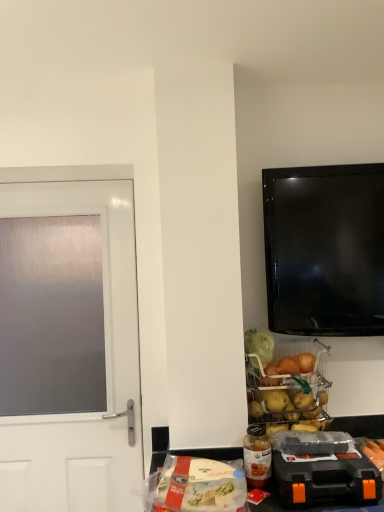
Question: From a real-world perspective, is orange plastic toolbox at lower right, which appears as the first appliance when viewed from the front, on top of translucent plastic bottle at lower center?

Choices:
 (A) no
 (B) yes

Answer: (A)

Question: Considering the relative positions of orange plastic toolbox at lower right, placed as the first appliance when sorted from bottom to top, and translucent plastic bottle at lower center in the image provided, is orange plastic toolbox at lower right, placed as the first appliance when sorted from bottom to top, to the right of translucent plastic bottle at lower center from the viewer's perspective?

Choices:
 (A) yes
 (B) no

Answer: (A)

Question: Is orange plastic toolbox at lower right, placed as the first appliance when sorted from bottom to top, turned away from translucent plastic bottle at lower center?

Choices:
 (A) no
 (B) yes

Answer: (A)

Question: Does orange plastic toolbox at lower right, which appears as the first appliance when viewed from the front, contain translucent plastic bottle at lower center?

Choices:
 (A) yes
 (B) no

Answer: (B)

Question: Is orange plastic toolbox at lower right, placed as the first appliance when sorted from bottom to top, directly adjacent to translucent plastic bottle at lower center?

Choices:
 (A) yes
 (B) no

Answer: (B)

Question: Is the position of orange plastic toolbox at lower right, the second appliance when ordered from top to bottom, more distant than that of translucent plastic bottle at lower center?

Choices:
 (A) yes
 (B) no

Answer: (B)

Question: Is translucent plastic bottle at lower center in front of metallic wire basket at lower center, the 2th appliance when ordered from front to back?

Choices:
 (A) no
 (B) yes

Answer: (B)

Question: Does translucent plastic bottle at lower center have a greater width compared to metallic wire basket at lower center, the 1th appliance from the top?

Choices:
 (A) no
 (B) yes

Answer: (A)

Question: Does translucent plastic bottle at lower center have a lesser width compared to metallic wire basket at lower center, which appears as the second appliance when ordered from the bottom?

Choices:
 (A) no
 (B) yes

Answer: (B)

Question: Are translucent plastic bottle at lower center and metallic wire basket at lower center, the 2th appliance when ordered from front to back, far apart?

Choices:
 (A) yes
 (B) no

Answer: (B)

Question: Is translucent plastic bottle at lower center oriented towards metallic wire basket at lower center, the 2th appliance when ordered from front to back?

Choices:
 (A) no
 (B) yes

Answer: (A)

Question: Does translucent plastic bottle at lower center have a lesser height compared to metallic wire basket at lower center, which appears as the second appliance when ordered from the bottom?

Choices:
 (A) yes
 (B) no

Answer: (A)

Question: Can you confirm if translucent plastic bottle at lower center is taller than satin white door at left?

Choices:
 (A) yes
 (B) no

Answer: (B)